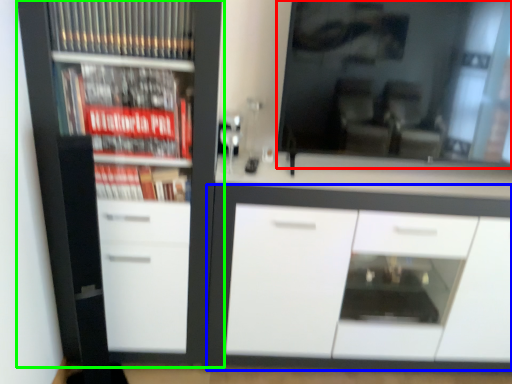
Question: Estimate the real-world distances between objects in this image. Which object is closer to mirror (highlighted by a red box), cabinetry (highlighted by a blue box) or cupboard (highlighted by a green box)?

Choices:
 (A) cabinetry
 (B) cupboard

Answer: (A)